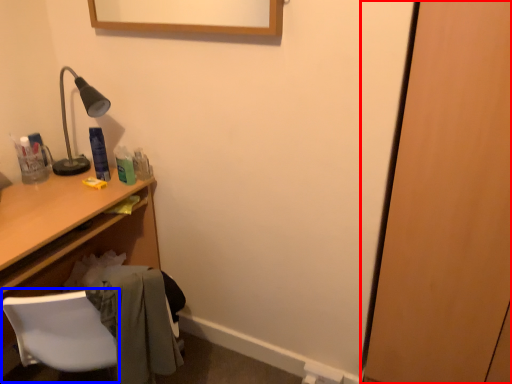
Question: Which of the following is the closest to the observer, door (highlighted by a red box) or computer chair (highlighted by a blue box)?

Choices:
 (A) door
 (B) computer chair

Answer: (A)